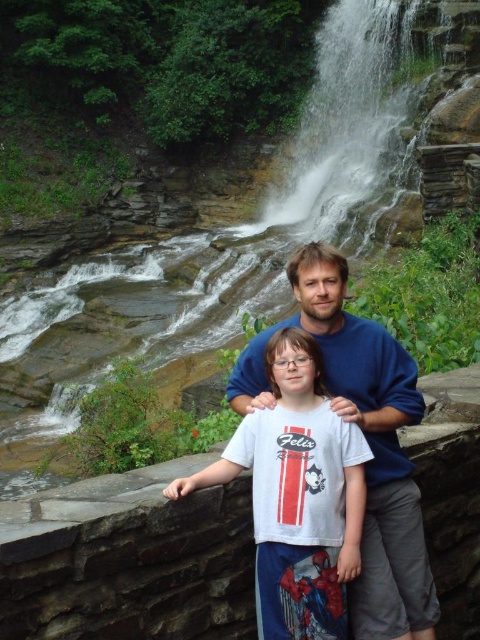
Based on the photo, does white cotton shirt at center lie in front of blue cotton shirt at center?

No, it is not.

Is white cotton shirt at center to the right of blue cotton shirt at center from the viewer's perspective?

No, white cotton shirt at center is not to the right of blue cotton shirt at center.

Is point (316, 556) behind point (338, 396)?

No, it is not.

You are a GUI agent. You are given a task and a screenshot of the screen. Output one action in this format:
    pyautogui.click(x=<x>, y=<y>)
    Task: Click on the white cotton shirt at center
    
    Given the screenshot: What is the action you would take?
    pyautogui.click(x=298, y=497)